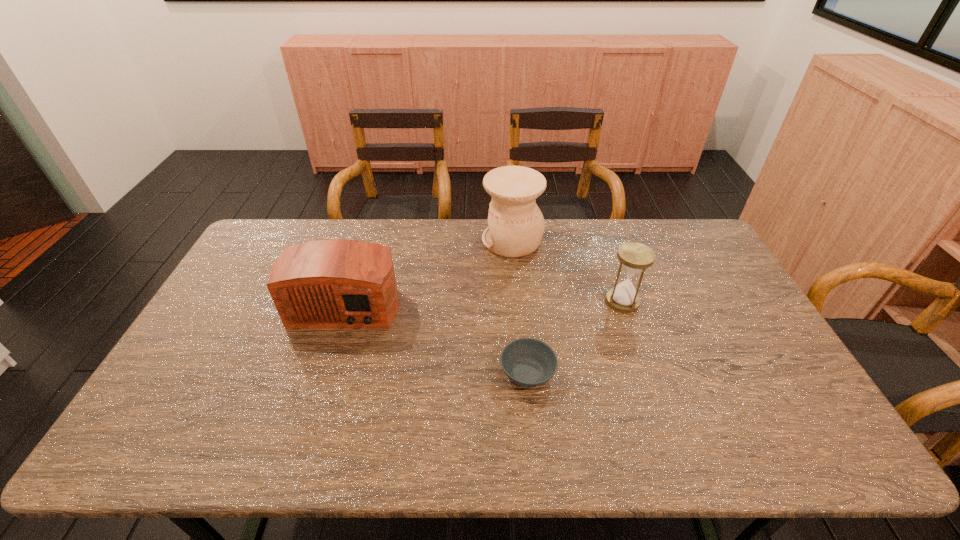
You are a GUI agent. You are given a task and a screenshot of the screen. Output one action in this format:
    pyautogui.click(x=<x>, y=<y>)
    Task: Click on the tallest object
    Image resolution: width=960 pixels, height=540 pixels.
    Given the screenshot: What is the action you would take?
    pyautogui.click(x=516, y=225)

You are a GUI agent. You are given a task and a screenshot of the screen. Output one action in this format:
    pyautogui.click(x=<x>, y=<y>)
    Task: Click on the pottery
    The width and height of the screenshot is (960, 540).
    Given the screenshot: What is the action you would take?
    pyautogui.click(x=516, y=225)

At what (x,y) coordinates should I click in order to perform the action: click on radio receiver. Please return your answer as a coordinate pair (x, y). The height and width of the screenshot is (540, 960). Looking at the image, I should click on (336, 283).

Identify the location of the rightmost object. Image resolution: width=960 pixels, height=540 pixels. (634, 258).

Find the location of `soup bowl`. soup bowl is located at coordinates (528, 362).

Locate an element on the screen. the shortest object is located at coordinates (528, 362).

Locate an element on the screen. vacant space located at the open side of the pottery is located at coordinates tap(372, 240).

Identify the location of free space located 0.070m at the open side of the pottery. (463, 240).

Identify the location of free location located at the open side of the pottery. (405, 240).

Find the location of a particular element. The height and width of the screenshot is (540, 960). vacant area located on the front-facing side of the radio receiver is located at coordinates (297, 456).